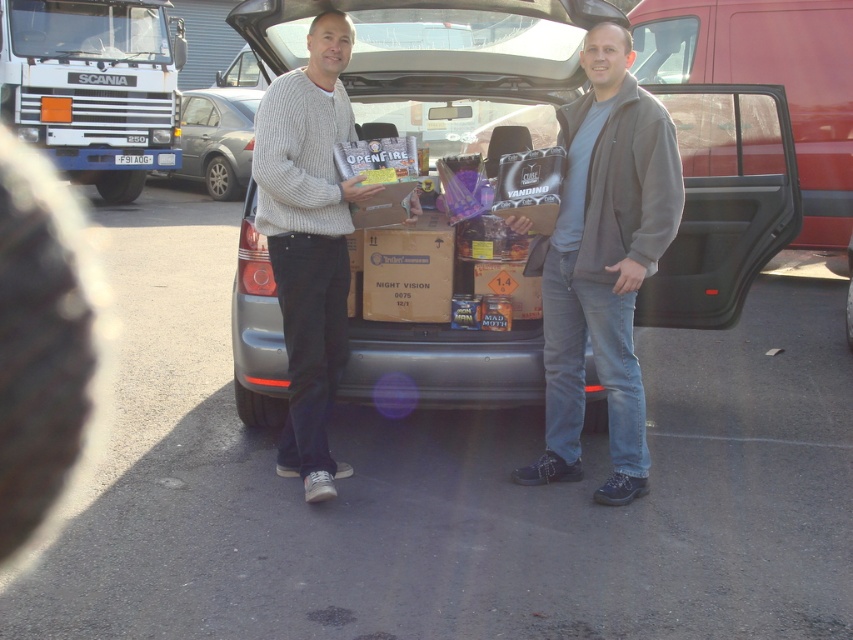
Question: Is white plastic truck at upper left thinner than brown cardboard box at center?

Choices:
 (A) yes
 (B) no

Answer: (B)

Question: Which point is closer to the camera?

Choices:
 (A) metallic red pickup truck at right
 (B) silver metallic sedan at center

Answer: (A)

Question: Which point is closer to the camera?

Choices:
 (A) metallic gray car at center
 (B) knitted sweater at center
 (C) silver metallic sedan at center
 (D) dark gray fleece jacket at center

Answer: (D)

Question: Can you confirm if dark gray fleece jacket at center is thinner than brown cardboard box at center?

Choices:
 (A) yes
 (B) no

Answer: (B)

Question: Is dark gray fleece jacket at center further to the viewer compared to silver metallic sedan at center?

Choices:
 (A) no
 (B) yes

Answer: (A)

Question: Considering the real-world distances, which object is closest to the metallic gray car at center?

Choices:
 (A) brown cardboard box at center
 (B) white plastic truck at upper left

Answer: (A)